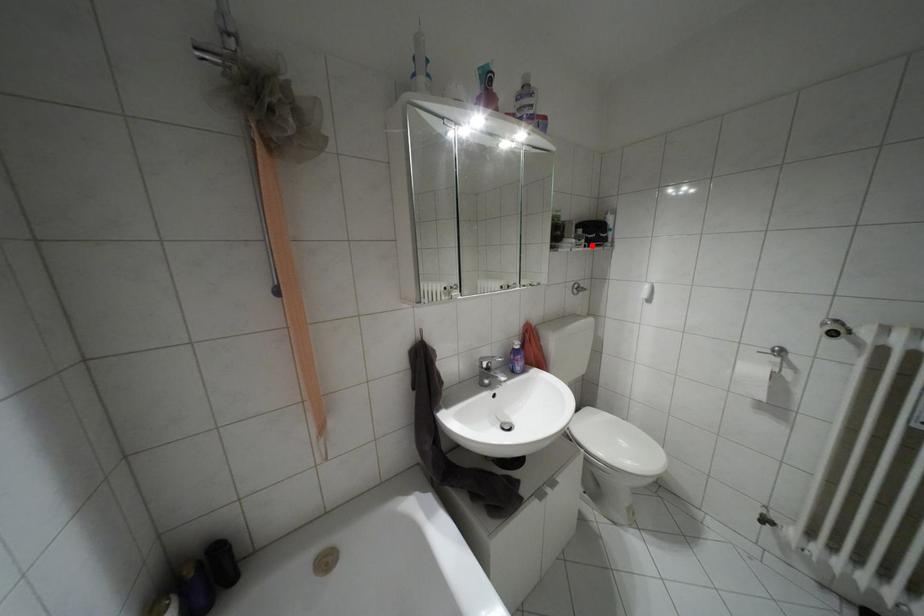
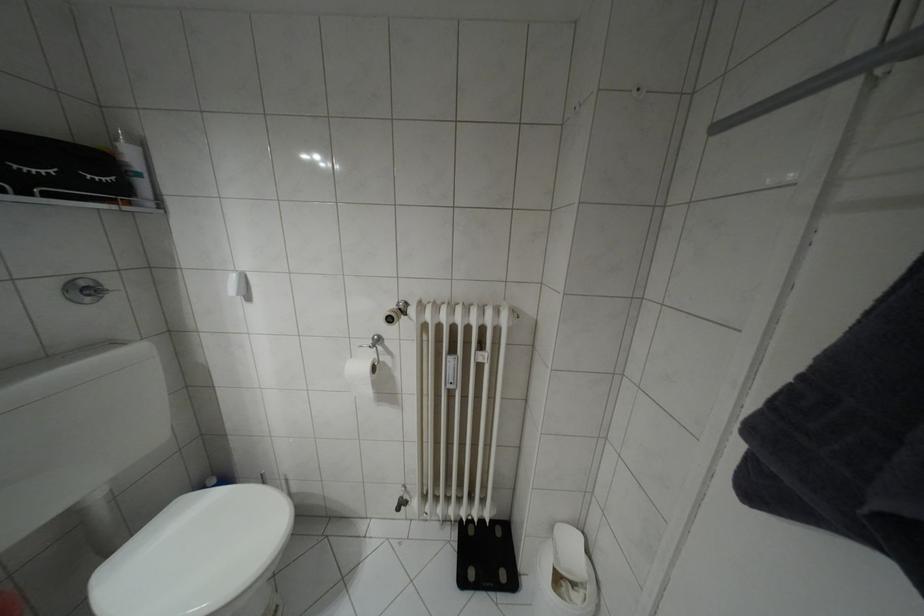
Where in the second image is the point corresponding to the highlighted location from the first image?

(49, 195)